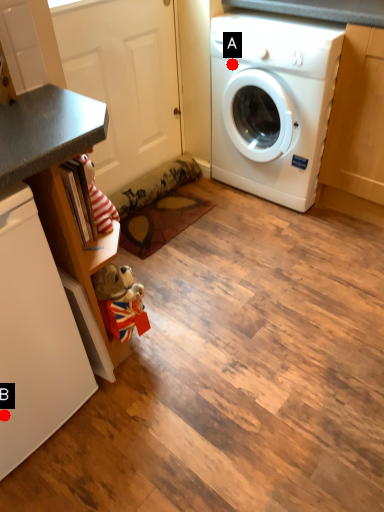
Question: Two points are circled on the image, labeled by A and B beside each circle. Which point appears farthest from the camera in this image?

Choices:
 (A) A is further
 (B) B is further

Answer: (A)